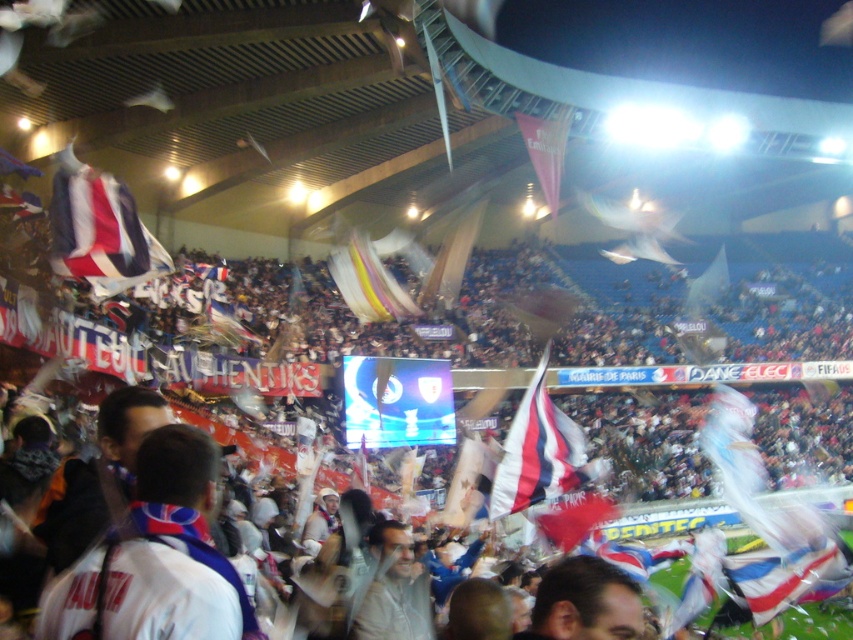
You are a photographer trying to capture the flag at the center of the stadium. You notice a point with coordinates (375, 275). Where exactly is this point located?

The point with coordinates (375, 275) is located on the translucent plastic flag at center.

You are a photographer at the stadium and want to capture a photo of both the white fabric flag at center and the white fabric head at center in the same frame. Which object should you focus on first to ensure both are in the frame?

The white fabric flag at center is wider than the white fabric head at center. Therefore, focus on the white fabric flag at center first to ensure both fit within the frame.

You are a photographer at the stadium and want to capture a photo that includes both the white fabric flag at center and the white fabric head at center. Which object should you position to the left in your camera frame to ensure both are visible?

To ensure both the white fabric flag at center and the white fabric head at center are visible, position the white fabric head at center to the left since the white fabric flag at center is on its right side.